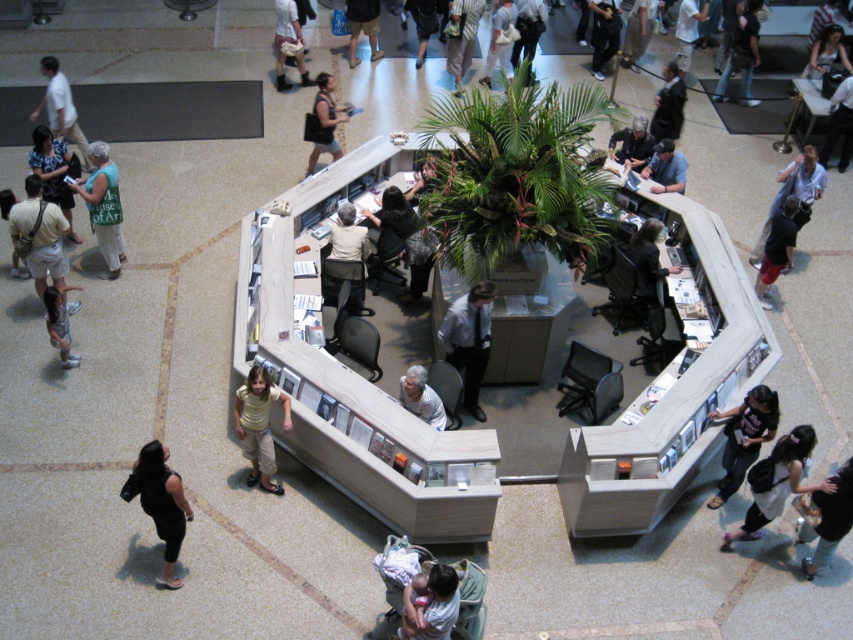
Question: Which object appears closest to the camera in this image?

Choices:
 (A) light blue denim jeans at lower left
 (B) matte beige pants at center

Answer: (A)

Question: Is the position of dark gray backpack at lower right more distant than that of dark gray pants at lower right?

Choices:
 (A) yes
 (B) no

Answer: (B)

Question: From the image, what is the correct spatial relationship of dark gray shirt at lower right in relation to dark suit at center?

Choices:
 (A) above
 (B) below

Answer: (B)

Question: Which point appears farthest from the camera in this image?

Choices:
 (A) (317, 141)
 (B) (798, 172)
 (C) (432, 424)
 (D) (679, 152)

Answer: (A)

Question: Does dark gray shirt at lower right appear on the right side of dark gray fabric jacket at center?

Choices:
 (A) no
 (B) yes

Answer: (B)

Question: Among these objects, which one is nearest to the camera?

Choices:
 (A) dark gray hoodie at upper right
 (B) light beige shirt at upper left
 (C) dark gray pants at lower right
 (D) light blue denim jeans at lower left

Answer: (D)